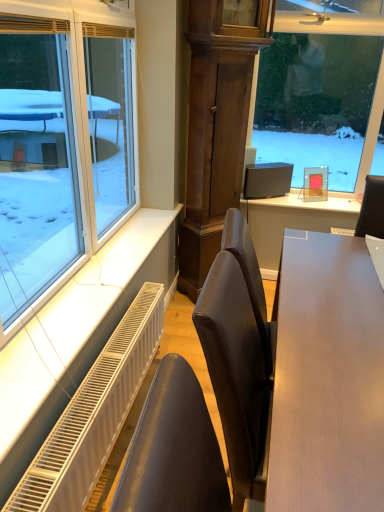
Question: Does white metal radiator at lower left have a larger size compared to light brown wooden table at center?

Choices:
 (A) no
 (B) yes

Answer: (A)

Question: Does white metal radiator at lower left have a greater width compared to light brown wooden table at center?

Choices:
 (A) no
 (B) yes

Answer: (A)

Question: Could you tell me if white metal radiator at lower left is turned towards light brown wooden table at center?

Choices:
 (A) yes
 (B) no

Answer: (A)

Question: Is white metal radiator at lower left touching light brown wooden table at center?

Choices:
 (A) yes
 (B) no

Answer: (B)

Question: Can we say white metal radiator at lower left lies outside light brown wooden table at center?

Choices:
 (A) yes
 (B) no

Answer: (A)

Question: From a real-world perspective, is satin black monitor at upper center physically located above or below white metal radiator at lower left?

Choices:
 (A) below
 (B) above

Answer: (B)

Question: Looking at their shapes, would you say satin black monitor at upper center is wider or thinner than white metal radiator at lower left?

Choices:
 (A) thin
 (B) wide

Answer: (B)

Question: Is satin black monitor at upper center inside the boundaries of white metal radiator at lower left, or outside?

Choices:
 (A) inside
 (B) outside

Answer: (B)

Question: Is point (271, 179) closer or farther from the camera than point (94, 386)?

Choices:
 (A) farther
 (B) closer

Answer: (A)

Question: Considering the relative positions of white metal radiator at lower left and light brown wooden table at center in the image provided, is white metal radiator at lower left to the left or to the right of light brown wooden table at center?

Choices:
 (A) right
 (B) left

Answer: (B)

Question: Considering the positions of point (86, 374) and point (331, 323), is point (86, 374) closer or farther from the camera than point (331, 323)?

Choices:
 (A) farther
 (B) closer

Answer: (A)

Question: Considering the positions of white metal radiator at lower left and light brown wooden table at center in the image, is white metal radiator at lower left bigger or smaller than light brown wooden table at center?

Choices:
 (A) big
 (B) small

Answer: (B)

Question: Is white metal radiator at lower left taller or shorter than light brown wooden table at center?

Choices:
 (A) tall
 (B) short

Answer: (B)

Question: Is light brown wooden table at center spatially inside satin black monitor at upper center, or outside of it?

Choices:
 (A) outside
 (B) inside

Answer: (A)

Question: Considering their positions, is light brown wooden table at center located in front of or behind satin black monitor at upper center?

Choices:
 (A) front
 (B) behind

Answer: (A)